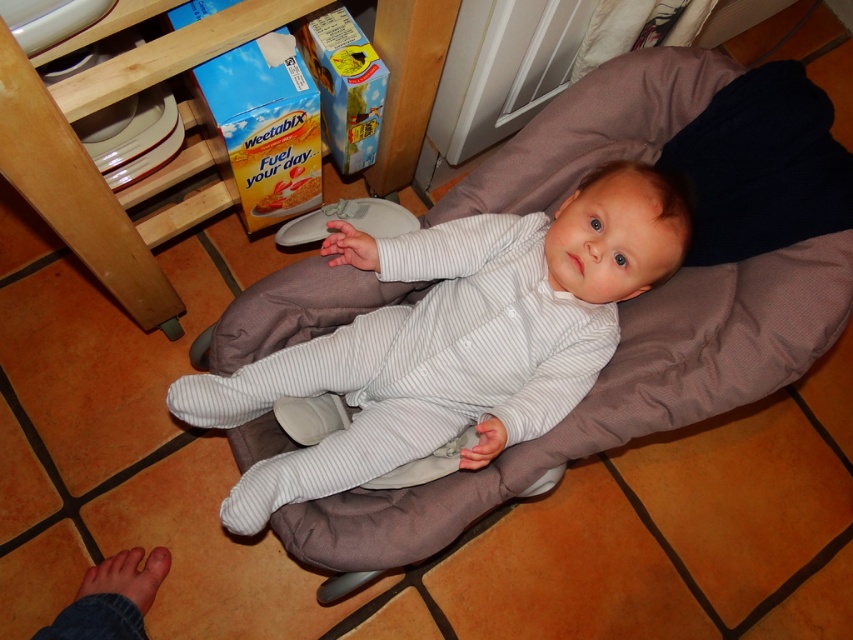
Question: Is gray fabric baby seat at center smaller than gray striped onesie at center?

Choices:
 (A) no
 (B) yes

Answer: (A)

Question: Does gray fabric baby seat at center come in front of gray striped onesie at center?

Choices:
 (A) yes
 (B) no

Answer: (B)

Question: Does gray fabric baby seat at center lie behind gray striped onesie at center?

Choices:
 (A) yes
 (B) no

Answer: (A)

Question: Which object is closer to the camera taking this photo?

Choices:
 (A) gray striped onesie at center
 (B) gray fabric baby seat at center

Answer: (A)

Question: Which of the following is the closest to the observer?

Choices:
 (A) (368, 509)
 (B) (648, 179)

Answer: (A)

Question: Which of the following is the farthest from the observer?

Choices:
 (A) gray striped onesie at center
 (B) gray fabric baby seat at center

Answer: (B)